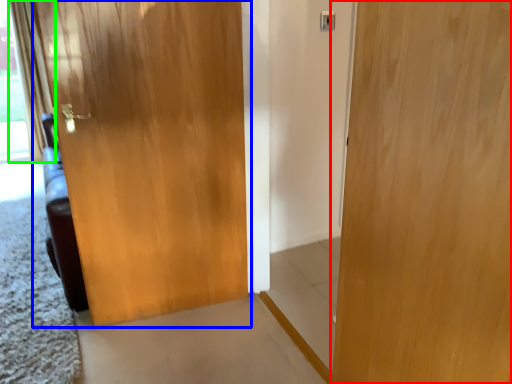
Question: Estimate the real-world distances between objects in this image. Which object is closer to door (highlighted by a red box), door (highlighted by a blue box) or curtain (highlighted by a green box)?

Choices:
 (A) door
 (B) curtain

Answer: (A)